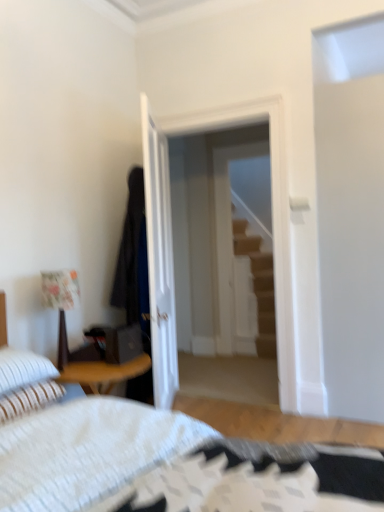
Question: Is transparent glass door at center completely or partially outside of white striped pillow at lower left, which appears as the second pillow when ordered from the bottom?

Choices:
 (A) yes
 (B) no

Answer: (A)

Question: Does transparent glass door at center turn towards white striped pillow at lower left, the first pillow viewed from the top?

Choices:
 (A) yes
 (B) no

Answer: (A)

Question: From a real-world perspective, is transparent glass door at center beneath white striped pillow at lower left, the first pillow viewed from the top?

Choices:
 (A) no
 (B) yes

Answer: (A)

Question: Does transparent glass door at center come behind white striped pillow at lower left, the first pillow viewed from the top?

Choices:
 (A) yes
 (B) no

Answer: (A)

Question: Considering the relative sizes of transparent glass door at center and white striped pillow at lower left, the first pillow viewed from the top, in the image provided, is transparent glass door at center wider than white striped pillow at lower left, the first pillow viewed from the top,?

Choices:
 (A) yes
 (B) no

Answer: (B)

Question: In terms of height, does transparent glass door at center look taller or shorter compared to white textured bed at lower left?

Choices:
 (A) tall
 (B) short

Answer: (A)

Question: In terms of width, does transparent glass door at center look wider or thinner when compared to white textured bed at lower left?

Choices:
 (A) thin
 (B) wide

Answer: (A)

Question: From the image's perspective, is transparent glass door at center above or below white textured bed at lower left?

Choices:
 (A) above
 (B) below

Answer: (A)

Question: Looking at the image, does transparent glass door at center seem bigger or smaller compared to white textured bed at lower left?

Choices:
 (A) small
 (B) big

Answer: (A)

Question: Visually, is white textured bed at lower left positioned to the left or to the right of dark blue fabric robe at center?

Choices:
 (A) left
 (B) right

Answer: (B)

Question: In terms of width, does white textured bed at lower left look wider or thinner when compared to dark blue fabric robe at center?

Choices:
 (A) thin
 (B) wide

Answer: (B)

Question: In terms of size, does white textured bed at lower left appear bigger or smaller than dark blue fabric robe at center?

Choices:
 (A) big
 (B) small

Answer: (A)

Question: Considering the positions of point (97, 497) and point (140, 172), is point (97, 497) closer or farther from the camera than point (140, 172)?

Choices:
 (A) closer
 (B) farther

Answer: (A)

Question: Is floral fabric lampshade at left spatially inside white textured bed at lower left, or outside of it?

Choices:
 (A) outside
 (B) inside

Answer: (A)

Question: Considering the positions of floral fabric lampshade at left and white textured bed at lower left in the image, is floral fabric lampshade at left wider or thinner than white textured bed at lower left?

Choices:
 (A) thin
 (B) wide

Answer: (A)